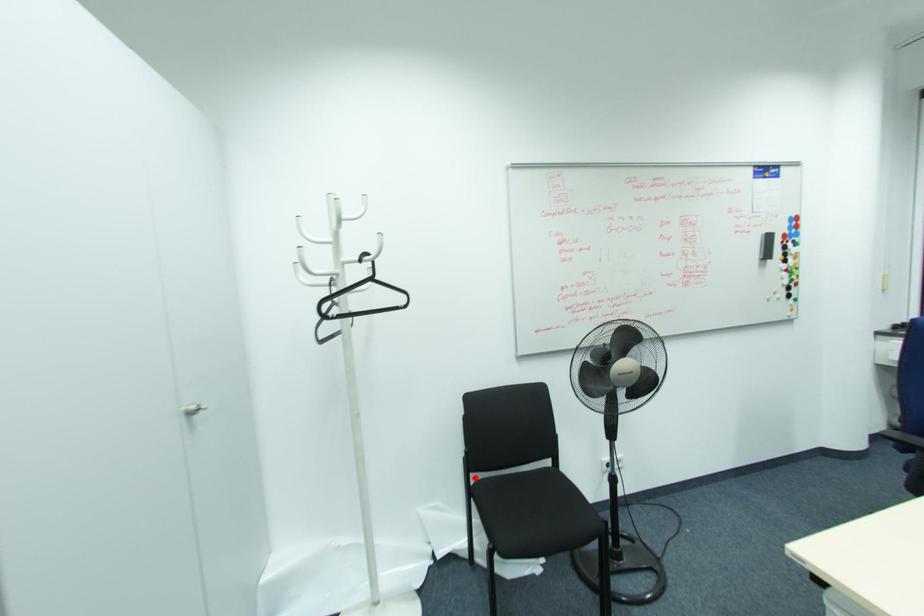
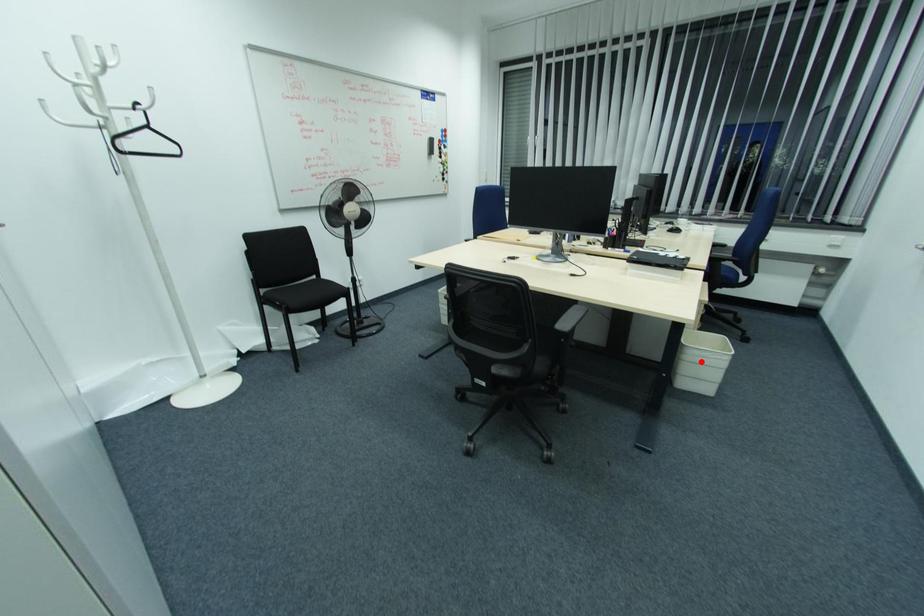
I am providing you with two images of the same scene from different viewpoints. A red point is marked on the first image and another point is marked on the second image. Do the highlighted points in image1 and image2 indicate the same real-world spot?

No